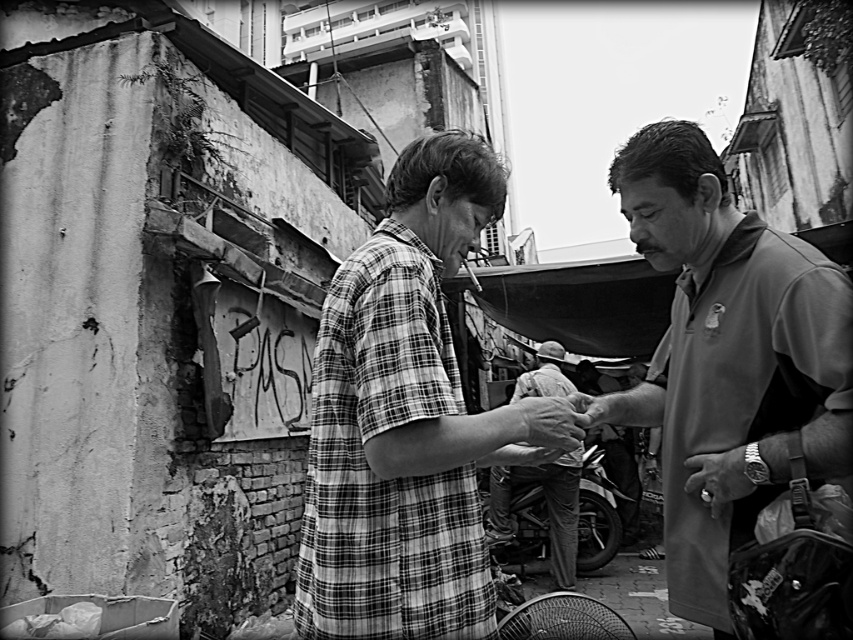
Question: Is plaid shirt at center behind smooth gray shirt at right?

Choices:
 (A) yes
 (B) no

Answer: (B)

Question: Which is nearer to the smooth gray shirt at right?

Choices:
 (A) light gray fabric shirt at center
 (B) plaid shirt at center

Answer: (B)

Question: Can you confirm if plaid shirt at center is bigger than smooth skin hand at center?

Choices:
 (A) yes
 (B) no

Answer: (A)

Question: Does light gray fabric shirt at center come behind smooth skin hand at center?

Choices:
 (A) yes
 (B) no

Answer: (A)

Question: Which of the following is the farthest from the observer?

Choices:
 (A) smooth gray shirt at right
 (B) light gray fabric shirt at center
 (C) plaid shirt at center

Answer: (B)

Question: Which of the following is the farthest from the observer?

Choices:
 (A) smooth skin hand at center
 (B) light gray fabric shirt at center
 (C) plaid shirt at center
 (D) smooth gray shirt at right

Answer: (B)